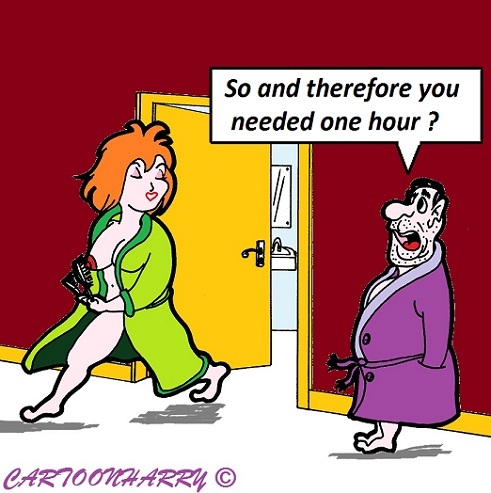
The image size is (491, 493). What are the coordinates of `yellow door` in the screenshot? It's located at (217, 275).